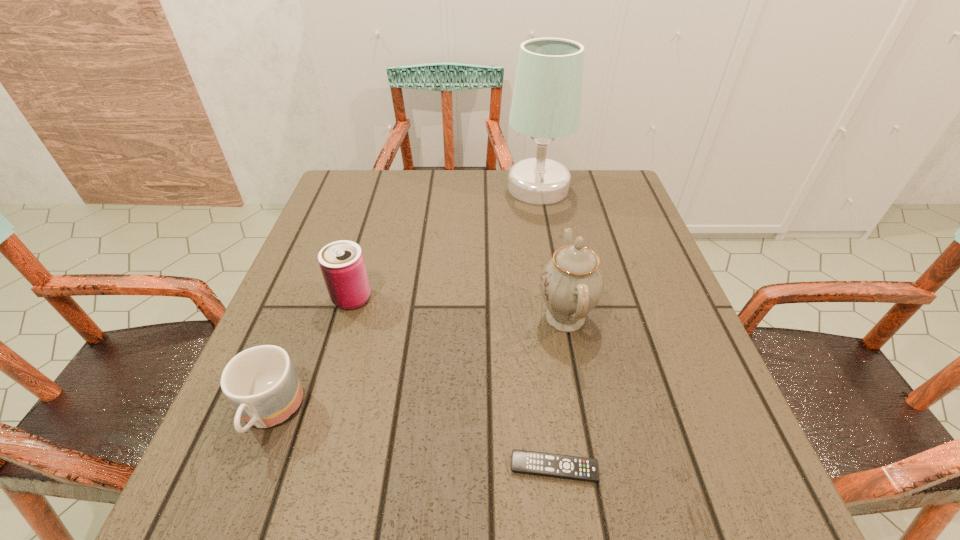
You are a GUI agent. You are given a task and a screenshot of the screen. Output one action in this format:
    pyautogui.click(x=<x>, y=<y>)
    Task: Click on the lampshade
    This screenshot has height=540, width=960.
    Given the screenshot: What is the action you would take?
    pyautogui.click(x=546, y=105)

This screenshot has height=540, width=960. I want to click on the farthest object, so click(546, 105).

Find the location of a particular element. This screenshot has height=540, width=960. chinaware is located at coordinates (571, 283).

In order to click on can in this screenshot , I will do `click(342, 264)`.

Find the location of a particular element. the fourth tallest object is located at coordinates (260, 382).

The height and width of the screenshot is (540, 960). In order to click on remote control in this screenshot , I will do `click(538, 463)`.

Where is `blank space located 0.100m on the base of the farthest object`? blank space located 0.100m on the base of the farthest object is located at coordinates (470, 187).

Image resolution: width=960 pixels, height=540 pixels. Identify the location of vacant space situated 0.190m on the base of the farthest object. (439, 187).

Where is `free space located 0.310m on the base of the farthest object`? free space located 0.310m on the base of the farthest object is located at coordinates (396, 187).

Where is `vacant region located on the spout of the chinaware`? The height and width of the screenshot is (540, 960). vacant region located on the spout of the chinaware is located at coordinates (495, 317).